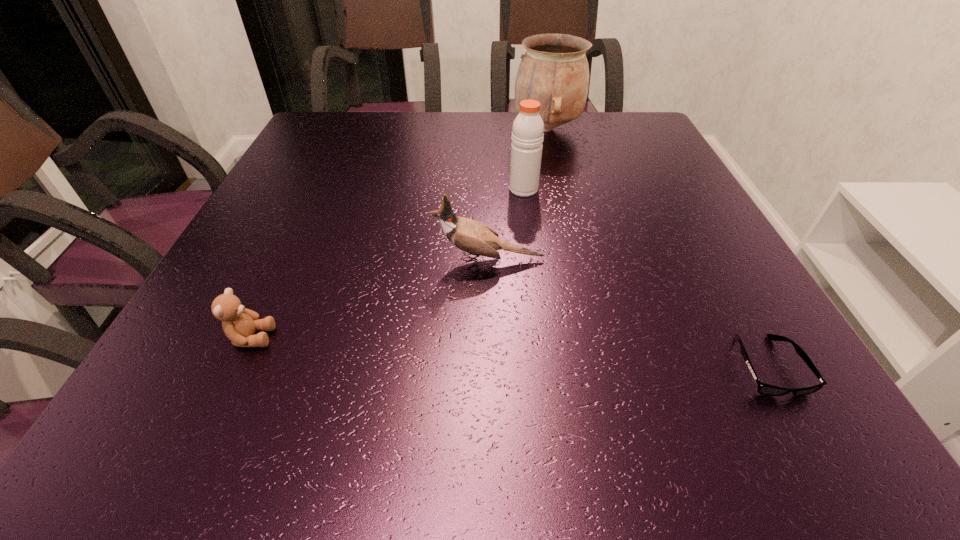
In the image, there is a desktop. At what (x,y) coordinates should I click in order to perform the action: click on vacant space at the far edge. Please return your answer as a coordinate pair (x, y). Looking at the image, I should click on (375, 141).

You are a GUI agent. You are given a task and a screenshot of the screen. Output one action in this format:
    pyautogui.click(x=<x>, y=<y>)
    Task: Click on the free space at the near edge
    
    Given the screenshot: What is the action you would take?
    pyautogui.click(x=335, y=432)

I want to click on free space at the left edge of the desktop, so click(281, 190).

Locate an element on the screen. The height and width of the screenshot is (540, 960). free space at the right edge is located at coordinates (758, 363).

Locate an element on the screen. The image size is (960, 540). vacant region at the far left corner of the desktop is located at coordinates (340, 129).

Locate an element on the screen. free space at the far right corner is located at coordinates (624, 132).

The image size is (960, 540). What are the coordinates of `free space between the rightmost object and the urn` in the screenshot? It's located at (658, 247).

At what (x,y) coordinates should I click in order to perform the action: click on vacant space that is in between the urn and the rightmost object. Please return your answer as a coordinate pair (x, y). This screenshot has height=540, width=960. Looking at the image, I should click on (658, 247).

This screenshot has width=960, height=540. Identify the location of vacant area between the sunglasses and the urn. (658, 247).

Find the location of `vacant area between the fourth tallest object and the farthest object`. vacant area between the fourth tallest object and the farthest object is located at coordinates (399, 233).